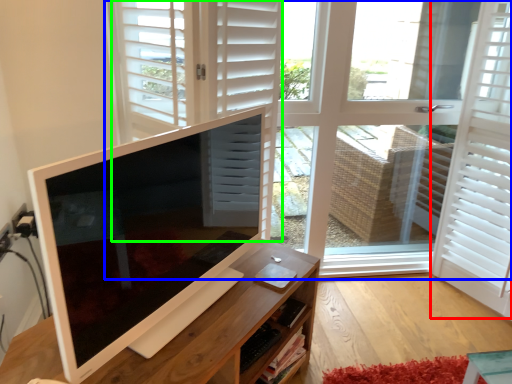
Question: Based on their relative distances, which object is nearer to shutter (highlighted by a red box)? Choose from window (highlighted by a blue box) and door (highlighted by a green box).

Choices:
 (A) window
 (B) door

Answer: (A)